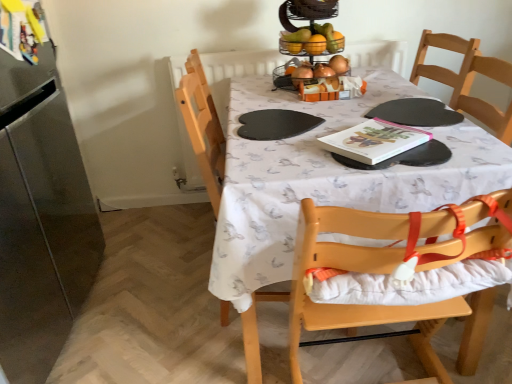
Question: Is point [393, 314] closer or farther from the camera than point [52, 208]?

Choices:
 (A) closer
 (B) farther

Answer: (A)

Question: From a real-world perspective, is light wood highchair at center physically located above or below stainless steel refrigerator at left?

Choices:
 (A) below
 (B) above

Answer: (A)

Question: Which of these objects is positioned farthest from the shiny metallic fruit basket at upper center?

Choices:
 (A) white printed tablecloth at center
 (B) light wood highchair at center
 (C) hardcover book at center
 (D) stainless steel refrigerator at left

Answer: (D)

Question: Estimate the real-world distances between objects in this image. Which object is farther from the white printed tablecloth at center?

Choices:
 (A) stainless steel refrigerator at left
 (B) light wood highchair at center
 (C) hardcover book at center
 (D) shiny metallic fruit basket at upper center

Answer: (A)